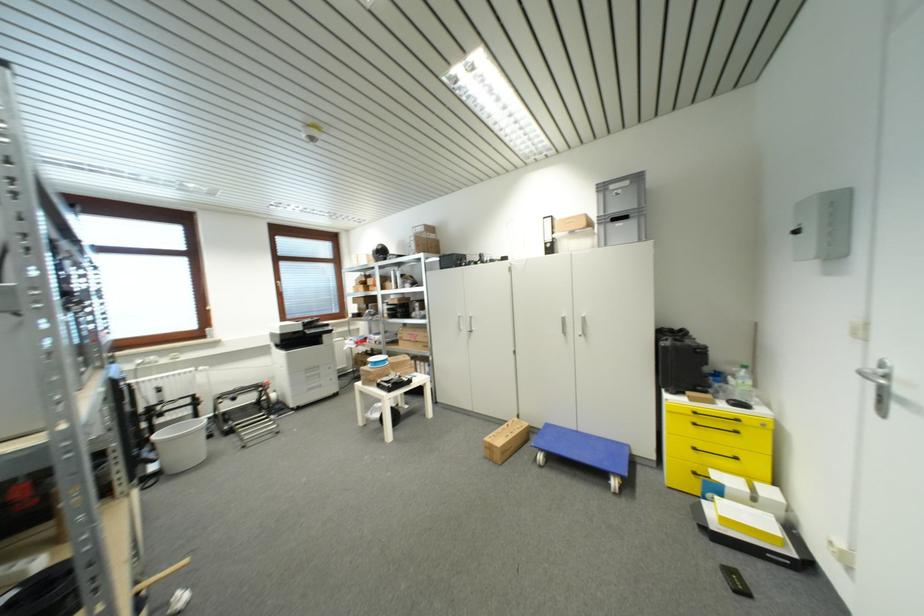
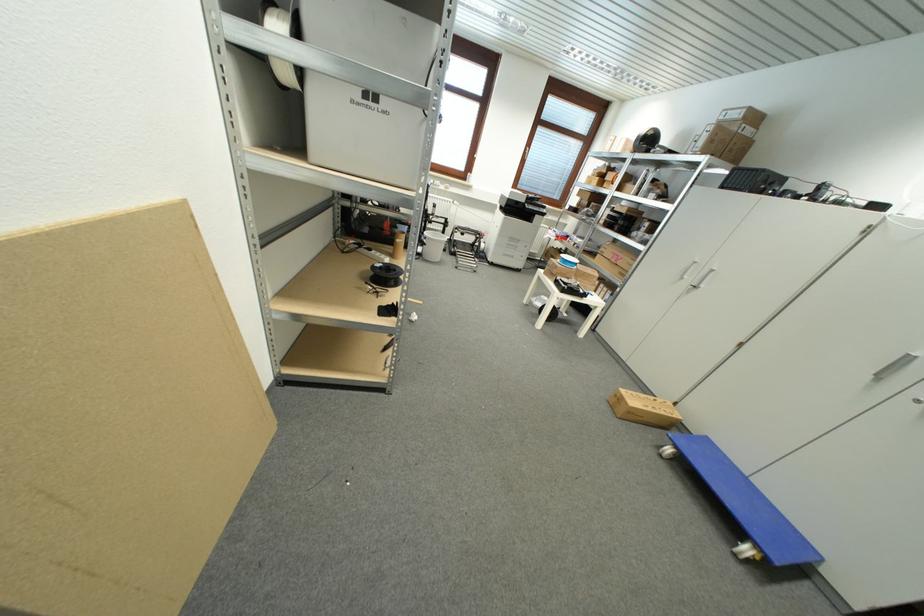
In the second image, find the point that corresponds to (x=247, y=411) in the first image.

(468, 246)